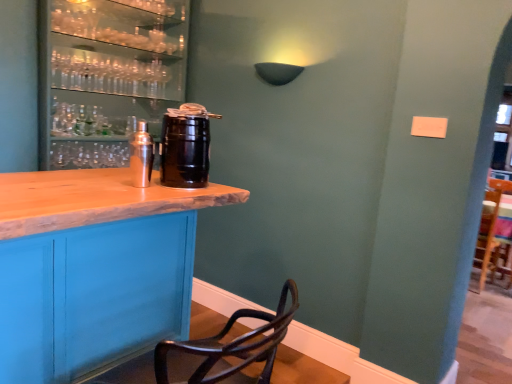
Question: Can you confirm if matte black barrel at left is wider than shiny silver shaker at center, the first beverage in the left-to-right sequence?

Choices:
 (A) no
 (B) yes

Answer: (B)

Question: From the image's perspective, would you say matte black barrel at left is positioned over shiny silver shaker at center, the first beverage in the left-to-right sequence?

Choices:
 (A) no
 (B) yes

Answer: (B)

Question: Is matte black barrel at left with shiny silver shaker at center, the first beverage in the left-to-right sequence?

Choices:
 (A) no
 (B) yes

Answer: (A)

Question: Considering the relative sizes of matte black barrel at left and shiny silver shaker at center, the first beverage in the left-to-right sequence, in the image provided, is matte black barrel at left taller than shiny silver shaker at center, the first beverage in the left-to-right sequence,?

Choices:
 (A) yes
 (B) no

Answer: (A)

Question: Considering the relative positions of matte black barrel at left and shiny silver shaker at center, which is counted as the second beverage, starting from the right, in the image provided, is matte black barrel at left behind shiny silver shaker at center, which is counted as the second beverage, starting from the right,?

Choices:
 (A) yes
 (B) no

Answer: (A)

Question: Looking at the image, does matte black barrel at left seem bigger or smaller compared to black matte keg at center, the second beverage positioned from the left?

Choices:
 (A) small
 (B) big

Answer: (B)

Question: Looking at their shapes, would you say matte black barrel at left is wider or thinner than black matte keg at center, the second beverage positioned from the left?

Choices:
 (A) thin
 (B) wide

Answer: (B)

Question: From their relative heights in the image, would you say matte black barrel at left is taller or shorter than black matte keg at center, the second beverage positioned from the left?

Choices:
 (A) short
 (B) tall

Answer: (B)

Question: In the image, is matte black barrel at left positioned in front of or behind black matte keg at center, the second beverage positioned from the left?

Choices:
 (A) front
 (B) behind

Answer: (B)

Question: In terms of size, does black matte keg at center, the second beverage positioned from the left, appear bigger or smaller than matte black barrel at left?

Choices:
 (A) big
 (B) small

Answer: (B)

Question: From a real-world perspective, relative to matte black barrel at left, is black matte keg at center, the second beverage positioned from the left, vertically above or below?

Choices:
 (A) above
 (B) below

Answer: (B)

Question: From the image's perspective, is black matte keg at center, the second beverage positioned from the left, above or below matte black barrel at left?

Choices:
 (A) below
 (B) above

Answer: (A)

Question: From their relative heights in the image, would you say black matte keg at center, the first beverage from the right, is taller or shorter than matte black barrel at left?

Choices:
 (A) short
 (B) tall

Answer: (A)

Question: From the image's perspective, is shiny silver shaker at center, the first beverage in the left-to-right sequence, positioned above or below black matte keg at center, the second beverage positioned from the left?

Choices:
 (A) above
 (B) below

Answer: (B)

Question: In terms of height, does shiny silver shaker at center, the first beverage in the left-to-right sequence, look taller or shorter compared to black matte keg at center, the first beverage from the right?

Choices:
 (A) short
 (B) tall

Answer: (A)